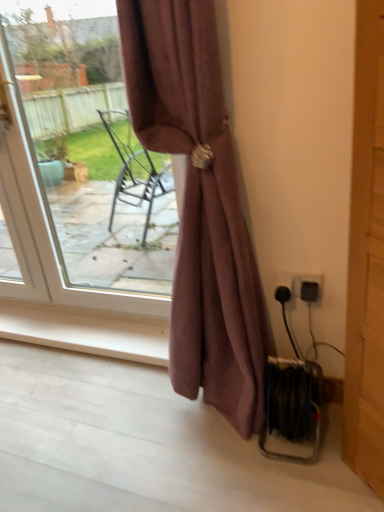
Question: Is black plastic socket at lower right, placed as the 2th electric outlet when sorted from right to left, smaller than matte white door at upper left?

Choices:
 (A) yes
 (B) no

Answer: (A)

Question: From a real-world perspective, is black plastic socket at lower right, the first electric outlet when ordered from left to right, physically below matte white door at upper left?

Choices:
 (A) yes
 (B) no

Answer: (A)

Question: Is black plastic socket at lower right, placed as the 2th electric outlet when sorted from right to left, not within matte white door at upper left?

Choices:
 (A) no
 (B) yes

Answer: (B)

Question: Does black plastic socket at lower right, the first electric outlet when ordered from left to right, have a lesser height compared to matte white door at upper left?

Choices:
 (A) no
 (B) yes

Answer: (B)

Question: Considering the relative sizes of black plastic socket at lower right, the first electric outlet when ordered from left to right, and matte white door at upper left in the image provided, is black plastic socket at lower right, the first electric outlet when ordered from left to right, taller than matte white door at upper left?

Choices:
 (A) no
 (B) yes

Answer: (A)

Question: In the image, is mauve fabric curtain at center on the left side or the right side of matte white door at upper left?

Choices:
 (A) left
 (B) right

Answer: (B)

Question: From the image's perspective, is mauve fabric curtain at center above or below matte white door at upper left?

Choices:
 (A) below
 (B) above

Answer: (A)

Question: Considering the positions of mauve fabric curtain at center and matte white door at upper left in the image, is mauve fabric curtain at center wider or thinner than matte white door at upper left?

Choices:
 (A) thin
 (B) wide

Answer: (B)

Question: Looking at the image, does mauve fabric curtain at center seem bigger or smaller compared to matte white door at upper left?

Choices:
 (A) big
 (B) small

Answer: (A)

Question: From the image's perspective, is matte white door at upper left above or below wooden door at right?

Choices:
 (A) below
 (B) above

Answer: (B)

Question: Is matte white door at upper left in front of or behind wooden door at right in the image?

Choices:
 (A) front
 (B) behind

Answer: (B)

Question: Is point (62, 228) closer or farther from the camera than point (375, 397)?

Choices:
 (A) closer
 (B) farther

Answer: (B)

Question: Looking at the image, does matte white door at upper left seem bigger or smaller compared to wooden door at right?

Choices:
 (A) small
 (B) big

Answer: (B)

Question: In terms of width, does black plastic electric outlet at lower right, acting as the first electric outlet starting from the right, look wider or thinner when compared to wooden door at right?

Choices:
 (A) thin
 (B) wide

Answer: (A)

Question: Considering the positions of black plastic electric outlet at lower right, acting as the first electric outlet starting from the right, and wooden door at right in the image, is black plastic electric outlet at lower right, acting as the first electric outlet starting from the right, taller or shorter than wooden door at right?

Choices:
 (A) short
 (B) tall

Answer: (A)